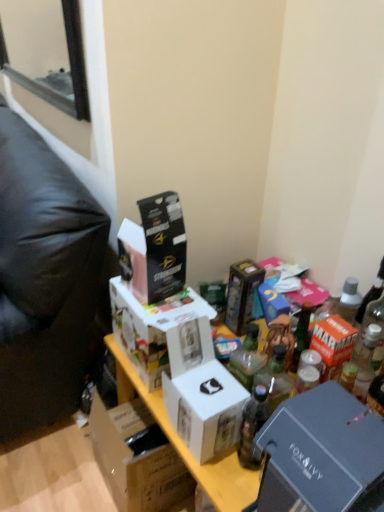
Question: From a real-world perspective, is black cardboard box at upper center, the sixth box when ordered from bottom to top, located higher than white cardboard box at center, the fourth box ordered from the bottom?

Choices:
 (A) yes
 (B) no

Answer: (A)

Question: From a real-world perspective, is black cardboard box at upper center, the sixth box when ordered from bottom to top, under white cardboard box at center, the fourth box ordered from the bottom?

Choices:
 (A) no
 (B) yes

Answer: (A)

Question: Is black cardboard box at upper center, the sixth box when ordered from bottom to top, further to the viewer compared to white cardboard box at center, the 3th box viewed from the top?

Choices:
 (A) yes
 (B) no

Answer: (B)

Question: Can you confirm if black cardboard box at upper center, the 1th box from the top, is smaller than white cardboard box at center, the fourth box ordered from the bottom?

Choices:
 (A) yes
 (B) no

Answer: (A)

Question: Does black cardboard box at upper center, the sixth box when ordered from bottom to top, have a larger size compared to white cardboard box at center, the 3th box viewed from the top?

Choices:
 (A) yes
 (B) no

Answer: (B)

Question: From a real-world perspective, is white cardboard box at center, the 4th box viewed from the top, physically located above or below metallic gray box at lower right, the 5th box when ordered from top to bottom?

Choices:
 (A) above
 (B) below

Answer: (B)

Question: Considering the positions of white cardboard box at center, which is the third box from bottom to top, and metallic gray box at lower right, the 5th box when ordered from top to bottom, in the image, is white cardboard box at center, which is the third box from bottom to top, wider or thinner than metallic gray box at lower right, the 5th box when ordered from top to bottom,?

Choices:
 (A) wide
 (B) thin

Answer: (B)

Question: From their relative heights in the image, would you say white cardboard box at center, which is the third box from bottom to top, is taller or shorter than metallic gray box at lower right, the 5th box when ordered from top to bottom?

Choices:
 (A) tall
 (B) short

Answer: (B)

Question: Is white cardboard box at center, which is the third box from bottom to top, spatially inside metallic gray box at lower right, the 5th box when ordered from top to bottom, or outside of it?

Choices:
 (A) inside
 (B) outside

Answer: (B)

Question: Choose the correct answer: Is white cardboard box at center, the fourth box ordered from the bottom, inside white cardboard box at center, which is the third box from bottom to top, or outside it?

Choices:
 (A) outside
 (B) inside

Answer: (A)

Question: From a real-world perspective, is white cardboard box at center, the 3th box viewed from the top, above or below white cardboard box at center, the 4th box viewed from the top?

Choices:
 (A) below
 (B) above

Answer: (A)

Question: In the image, is white cardboard box at center, the 3th box viewed from the top, positioned in front of or behind white cardboard box at center, which is the third box from bottom to top?

Choices:
 (A) front
 (B) behind

Answer: (B)

Question: From the image's perspective, is white cardboard box at center, the 3th box viewed from the top, positioned above or below white cardboard box at center, which is the third box from bottom to top?

Choices:
 (A) above
 (B) below

Answer: (A)

Question: From the image's perspective, is clear glass bottle at upper right, which appears as the 2th bottle when viewed from the front, positioned above or below metallic gold box at center, acting as the 5th box starting from the bottom?

Choices:
 (A) above
 (B) below

Answer: (B)

Question: Is clear glass bottle at upper right, which is counted as the second bottle, starting from the left, in front of or behind metallic gold box at center, acting as the 5th box starting from the bottom, in the image?

Choices:
 (A) behind
 (B) front

Answer: (B)